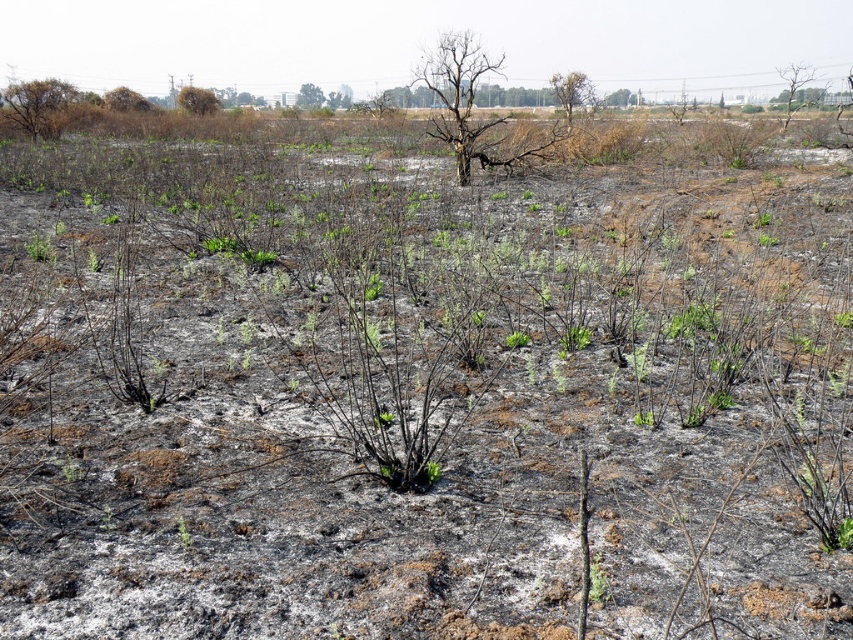
You are a firefighter assessing the fire damage. You notice two trees at the upper left corner of the scene. The burnt wood tree at upper left and the brown dry tree at upper left. Which tree is farther from the other?

The burnt wood tree at upper left is 10.00 meters away from the brown dry tree at upper left, so they are both at a distance of 10 meters apart from each other.

You are a researcher analyzing the fire damage in the image. You need to locate the brown dry wood at upper center for your report. What are its coordinates?

The brown dry wood at upper center is located at coordinates (572, 92).

You are a firefighter assessing the area after a wildfire. You notice a point marked at coordinates (572,92). What object is located at this point?

The point at coordinates (572,92) corresponds to brown dry wood at upper center.